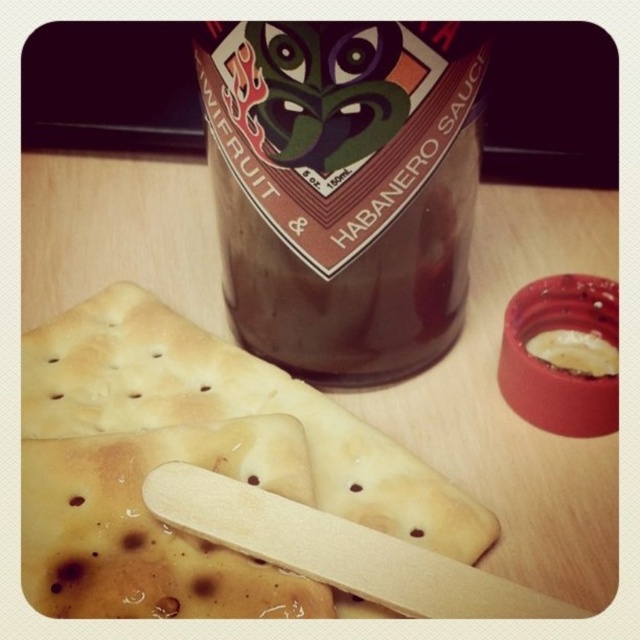
You are a chef preparing a dish and need to place the brown glass bottle at center and the yellowish creamy spread at upper right on a shelf. The shelf has a maximum length of 40 centimeters. Can both items fit side by side on the shelf without overlapping?

The brown glass bottle at center is 39.11 centimeters away from the yellowish creamy spread at upper right. Since the distance between them is less than the shelf length of 40 centimeters, both items can fit side by side on the shelf without overlapping.

You are arranging snacks on a table and have the brown glass bottle at center and the yellowish creamy spread at upper right. According to the image, which item is located to the right of the other?

The yellowish creamy spread at upper right is located to the right of the brown glass bottle at center.

You are arranging snacks on a table and need to place a new cracker so it doesn not block the view of the Habanero Sauce bottle. Where should you place the new cracker relative to the crusty white cracker at center?

The crusty white cracker at center is located at point (193,464). To avoid blocking the view of the Habanero Sauce bottle, place the new cracker either to the left or right of the crusty white cracker at center, ensuring it doesn not overlap with its position at (193,464).